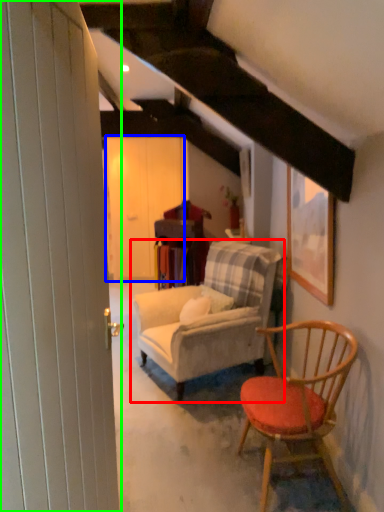
Question: Which object is positioned farthest from studio couch (highlighted by a red box)? Select from barn door (highlighted by a blue box) and barn door (highlighted by a green box).

Choices:
 (A) barn door
 (B) barn door

Answer: (A)